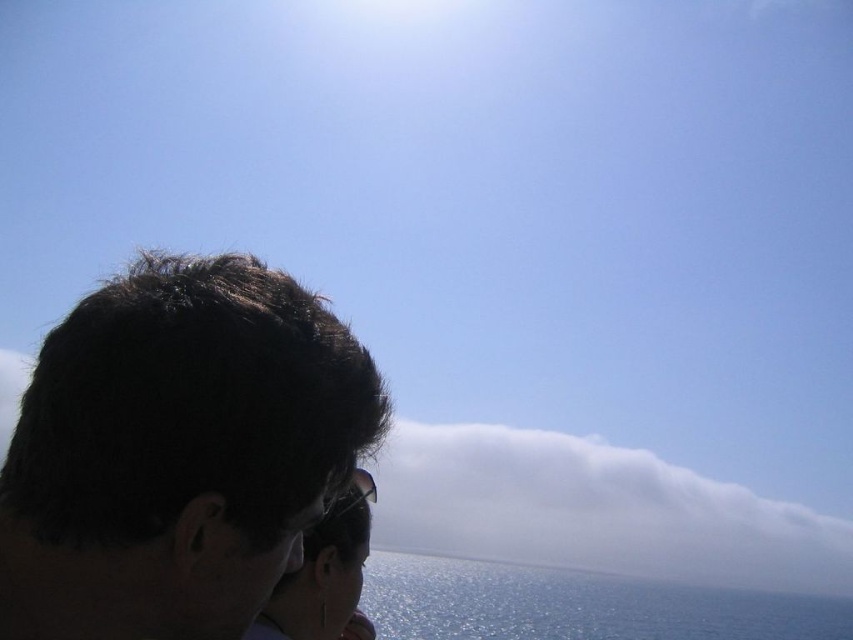
From the picture: Is white fluffy cloud at lower center further to camera compared to blue glossy water at lower center?

Yes, white fluffy cloud at lower center is behind blue glossy water at lower center.

Which is below, white fluffy cloud at lower center or blue glossy water at lower center?

Positioned lower is white fluffy cloud at lower center.

What do you see at coordinates (595, 512) in the screenshot?
I see `white fluffy cloud at lower center` at bounding box center [595, 512].

Find the location of a particular element. white fluffy cloud at lower center is located at coordinates (595, 512).

This screenshot has height=640, width=853. What do you see at coordinates (177, 451) in the screenshot? I see `dark brown hair at left` at bounding box center [177, 451].

Who is higher up, dark brown hair at left or white fluffy cloud at lower center?

dark brown hair at left is above.

At what (x,y) coordinates should I click in order to perform the action: click on dark brown hair at left. Please return your answer as a coordinate pair (x, y). Looking at the image, I should click on (177, 451).

Is dark brown hair at left smaller than sunglasses at center?

Correct, dark brown hair at left occupies less space than sunglasses at center.

Who is more distant from viewer, (117, 387) or (320, 605)?

→ Point (320, 605)

Identify the location of dark brown hair at left. Image resolution: width=853 pixels, height=640 pixels. (177, 451).